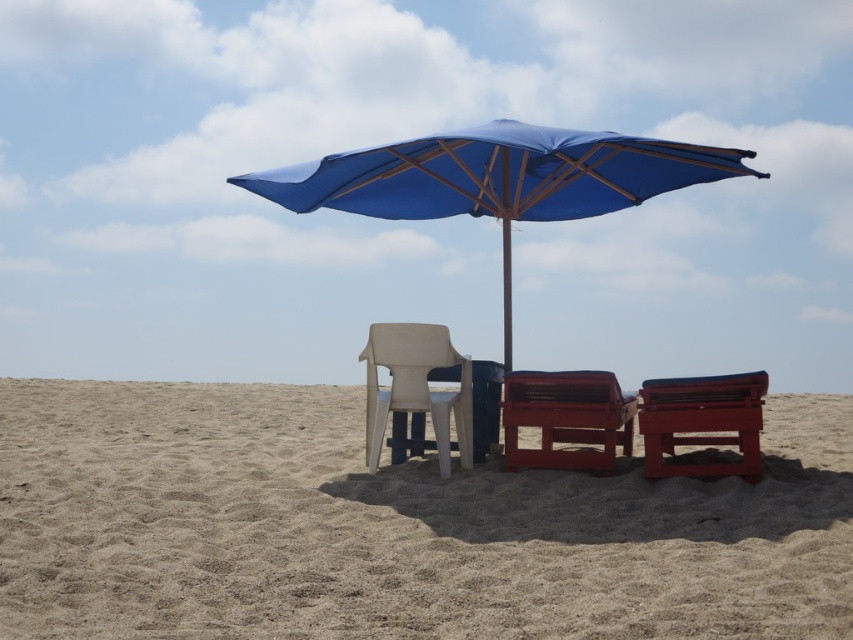
You are planning to set up a sunbathing spot on the beach. You have two options for chairs. The first is the matte red beach chair at center, and the second is the matte red plastic beach chair at lower right. Which chair is positioned lower on the image?

The matte red beach chair at center is located below the matte red plastic beach chair at lower right, so the matte red beach chair at center is positioned lower on the image.

You are standing on the beach and want to move from the white plastic beach chair at center to the matte red beach chair at center. Which direction should you move in?

The matte red beach chair at center is closer to the viewer than the white plastic beach chair at center, so you should move towards the direction where the white plastic beach chair at center is located to reach the matte red beach chair at center.

You are standing at the origin point of the coordinate system in the beach scene. You want to walk to the matte red beach chair at center. What are the coordinates you need to move to?

The coordinates to move to are approximately 0.653 in the x direction and 0.665 in the y direction.